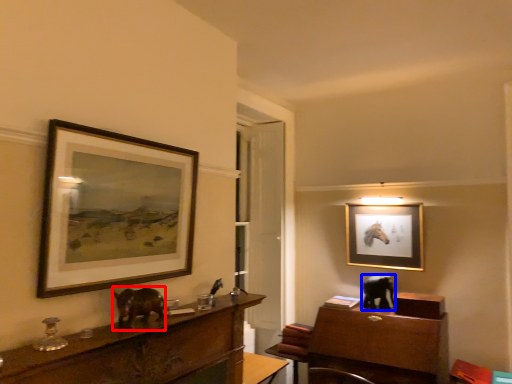
Question: Among these objects, which one is nearest to the camera, animal (highlighted by a red box) or animal (highlighted by a blue box)?

Choices:
 (A) animal
 (B) animal

Answer: (A)